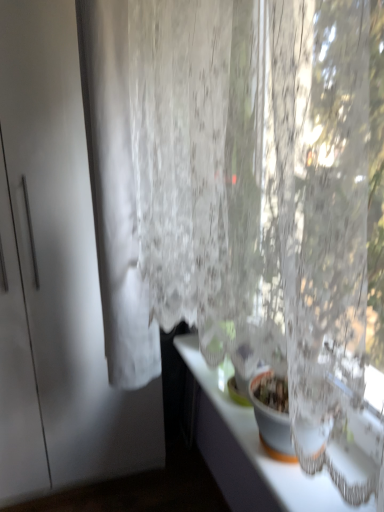
Question: Is white matte screen door at left thinner than white glossy counter top at lower right?

Choices:
 (A) no
 (B) yes

Answer: (A)

Question: Can you confirm if white matte screen door at left is taller than white glossy counter top at lower right?

Choices:
 (A) yes
 (B) no

Answer: (A)

Question: Considering the relative sizes of white matte screen door at left and white glossy counter top at lower right in the image provided, is white matte screen door at left bigger than white glossy counter top at lower right?

Choices:
 (A) yes
 (B) no

Answer: (A)

Question: Does white matte screen door at left appear on the left side of white glossy counter top at lower right?

Choices:
 (A) no
 (B) yes

Answer: (B)

Question: Is white matte screen door at left further to camera compared to white glossy counter top at lower right?

Choices:
 (A) no
 (B) yes

Answer: (B)

Question: Would you say white sheer curtain at left is inside or outside white glossy counter top at lower right?

Choices:
 (A) inside
 (B) outside

Answer: (B)

Question: Is point (120, 142) closer or farther from the camera than point (268, 484)?

Choices:
 (A) closer
 (B) farther

Answer: (B)

Question: Considering the positions of white sheer curtain at left and white glossy counter top at lower right in the image, is white sheer curtain at left taller or shorter than white glossy counter top at lower right?

Choices:
 (A) short
 (B) tall

Answer: (B)

Question: Would you say white sheer curtain at left is to the left or to the right of white glossy counter top at lower right in the picture?

Choices:
 (A) left
 (B) right

Answer: (A)

Question: Considering their positions, is white glossy counter top at lower right located in front of or behind white matte screen door at left?

Choices:
 (A) behind
 (B) front

Answer: (B)

Question: Visually, is white glossy counter top at lower right positioned to the left or to the right of white matte screen door at left?

Choices:
 (A) left
 (B) right

Answer: (B)

Question: From a real-world perspective, is white glossy counter top at lower right positioned above or below white matte screen door at left?

Choices:
 (A) below
 (B) above

Answer: (A)

Question: Is white glossy counter top at lower right bigger or smaller than white matte screen door at left?

Choices:
 (A) big
 (B) small

Answer: (B)

Question: Looking at the image, does white sheer curtain at left seem bigger or smaller compared to white matte screen door at left?

Choices:
 (A) big
 (B) small

Answer: (B)

Question: Considering the positions of white sheer curtain at left and white matte screen door at left in the image, is white sheer curtain at left taller or shorter than white matte screen door at left?

Choices:
 (A) short
 (B) tall

Answer: (A)